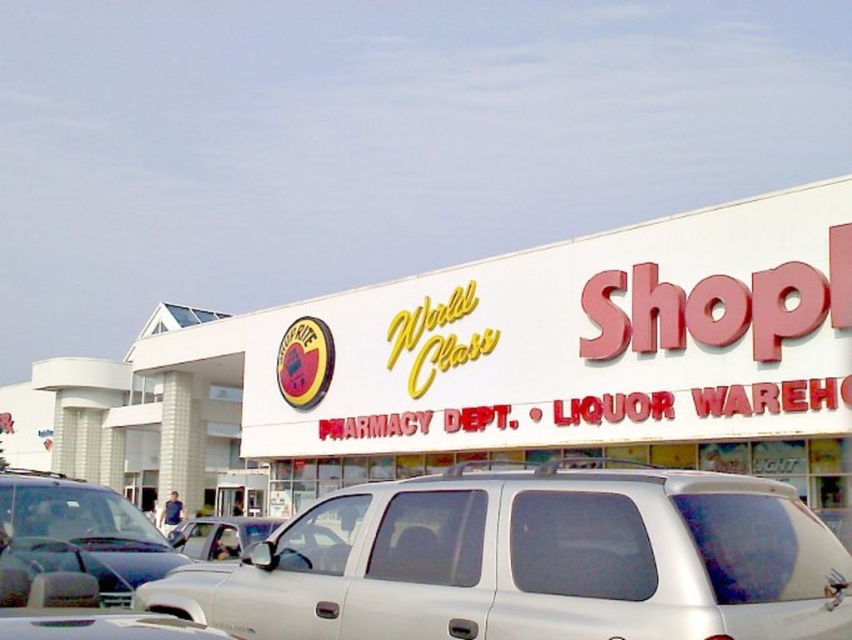
Question: Is white matte building at center further to the viewer compared to shiny silver suv at lower left?

Choices:
 (A) yes
 (B) no

Answer: (A)

Question: Does white matte building at center appear on the right side of metallic silver suv at center?

Choices:
 (A) no
 (B) yes

Answer: (A)

Question: Which of the following is the farthest from the observer?

Choices:
 (A) white matte minivan at center
 (B) white matte building at center

Answer: (B)

Question: Estimate the real-world distances between objects in this image. Which object is closer to the shiny silver suv at lower left?

Choices:
 (A) white matte minivan at center
 (B) metallic silver suv at center

Answer: (B)

Question: Estimate the real-world distances between objects in this image. Which object is farther from the white matte minivan at center?

Choices:
 (A) shiny silver suv at lower left
 (B) white matte building at center

Answer: (B)

Question: Can you confirm if white matte building at center is positioned below white matte minivan at center?

Choices:
 (A) no
 (B) yes

Answer: (B)